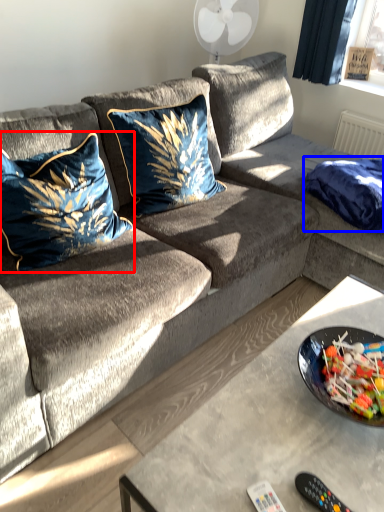
Question: Among these objects, which one is farthest to the camera, pillow (highlighted by a red box) or blanket (highlighted by a blue box)?

Choices:
 (A) pillow
 (B) blanket

Answer: (B)